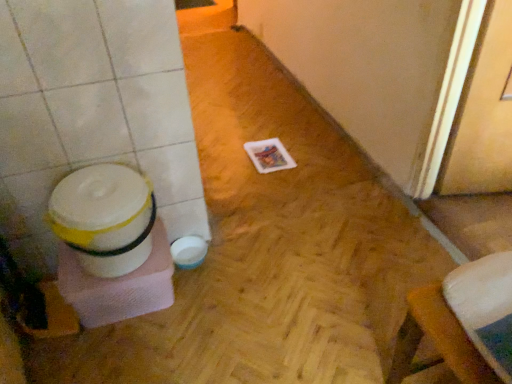
Question: Is wooden screen door at right bigger or smaller than white plastic potty at left?

Choices:
 (A) small
 (B) big

Answer: (B)

Question: From the image's perspective, relative to white plastic potty at left, is wooden screen door at right above or below?

Choices:
 (A) above
 (B) below

Answer: (A)

Question: From a real-world perspective, is wooden screen door at right above or below white plastic potty at left?

Choices:
 (A) above
 (B) below

Answer: (A)

Question: From a real-world perspective, is white plastic potty at left above or below wooden screen door at right?

Choices:
 (A) above
 (B) below

Answer: (B)

Question: Is white plastic potty at left in front of or behind wooden screen door at right in the image?

Choices:
 (A) behind
 (B) front

Answer: (A)

Question: From the image's perspective, is white plastic potty at left located above or below wooden screen door at right?

Choices:
 (A) below
 (B) above

Answer: (A)

Question: Based on their sizes in the image, would you say white plastic potty at left is bigger or smaller than wooden screen door at right?

Choices:
 (A) big
 (B) small

Answer: (B)